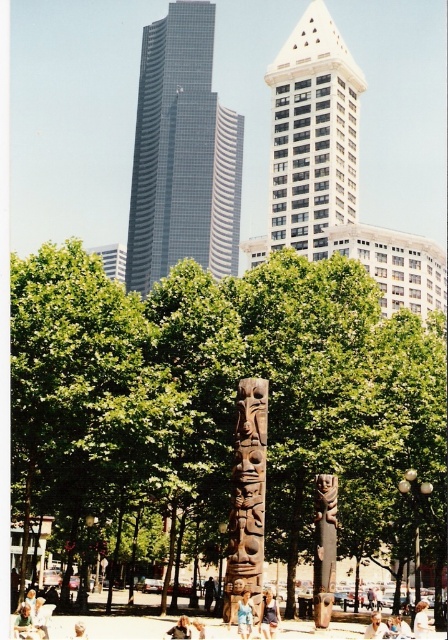
Who is shorter, brown wooden totem pole at center or light brown wooden chair at lower center?

With less height is light brown wooden chair at lower center.

Consider the image. Between brown wooden totem pole at center and light brown wooden chair at lower center, which one is positioned higher?

Positioned higher is brown wooden totem pole at center.

Locate an element on the screen. The image size is (448, 640). brown wooden totem pole at center is located at coordinates (324, 547).

Find the location of a particular element. The image size is (448, 640). brown wooden totem pole at center is located at coordinates (324, 547).

Does dark brown wood totem pole at center appear under light brown wooden chair at lower center?

No.

Which is below, dark brown wood totem pole at center or light brown wooden chair at lower center?

light brown wooden chair at lower center is lower down.

Who is more distant from viewer, (245, 452) or (369, 634)?

The point (369, 634) is behind.

Identify the location of dark brown wood totem pole at center. This screenshot has height=640, width=448. (246, 497).

Between light brown wooden chair at lower center and light brown wooden statue at lower center, which one is positioned higher?

Positioned higher is light brown wooden statue at lower center.

Identify the location of light brown wooden chair at lower center. The height and width of the screenshot is (640, 448). (377, 627).